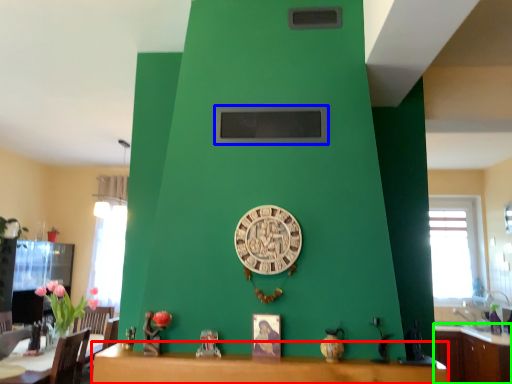
Question: Which object is the farthest from table (highlighted by a red box)? Choose among these: window screen (highlighted by a blue box) or cabinetry (highlighted by a green box).

Choices:
 (A) window screen
 (B) cabinetry

Answer: (B)